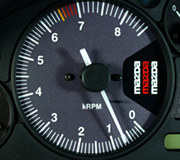
Identify the location of console. (11, 22).